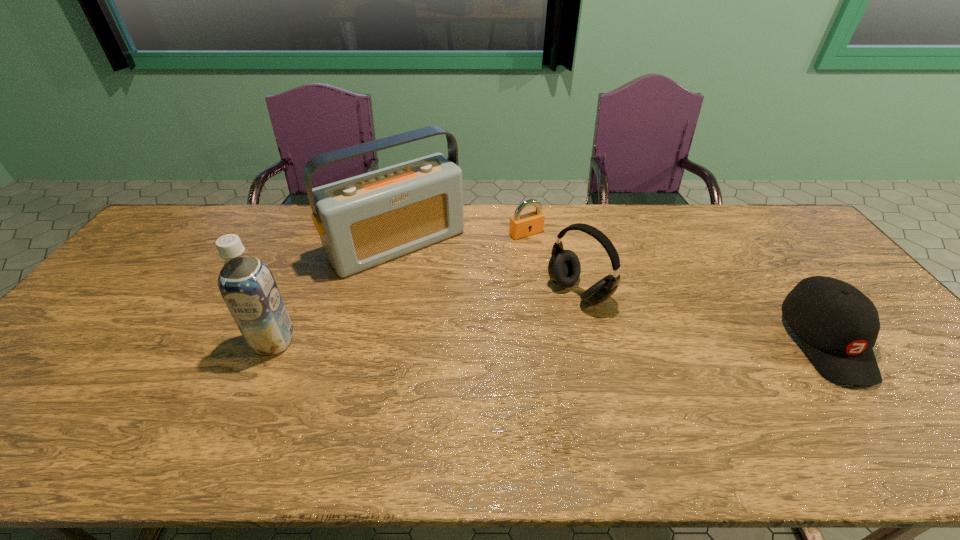
Locate an element on the screen. The width and height of the screenshot is (960, 540). soya milk is located at coordinates (247, 286).

Identify the location of baseball cap. The image size is (960, 540). (838, 326).

Find the location of `radio receiver`. radio receiver is located at coordinates (363, 221).

Where is `headset`? The height and width of the screenshot is (540, 960). headset is located at coordinates (564, 268).

Locate an element on the screen. padlock is located at coordinates (530, 223).

At what (x,y) coordinates should I click in order to perform the action: click on vacant space located 0.060m on the label of the soya milk. Please return your answer as a coordinate pair (x, y). Looking at the image, I should click on (258, 376).

I want to click on vacant area situated 0.340m on the front-facing side of the radio receiver, so click(493, 347).

Locate an element on the screen. vacant space located 0.350m on the front-facing side of the radio receiver is located at coordinates (495, 350).

Locate an element on the screen. This screenshot has height=540, width=960. vacant space located on the front-facing side of the radio receiver is located at coordinates (438, 283).

Image resolution: width=960 pixels, height=540 pixels. I want to click on free point located 0.210m on the ear cups of the headset, so (505, 348).